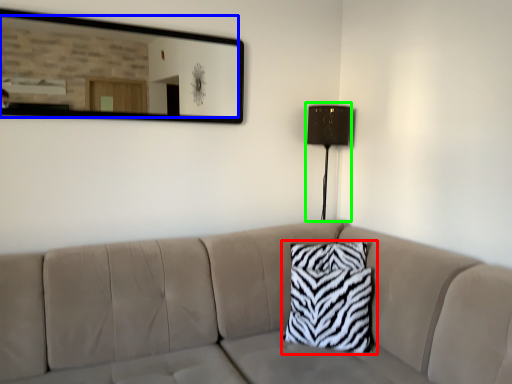
Question: Which is nearer to the pillow (highlighted by a red box)? mirror (highlighted by a blue box) or table lamp (highlighted by a green box).

Choices:
 (A) mirror
 (B) table lamp

Answer: (B)